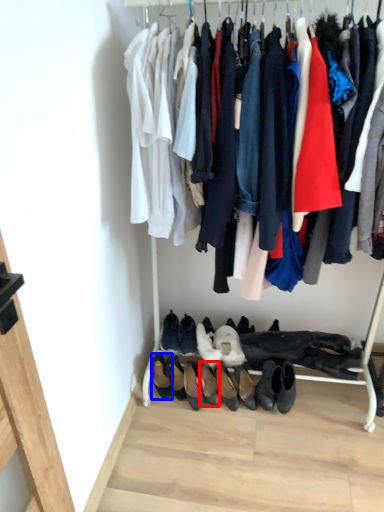
Question: Which point is further to the camera, footwear (highlighted by a red box) or footwear (highlighted by a blue box)?

Choices:
 (A) footwear
 (B) footwear

Answer: (B)